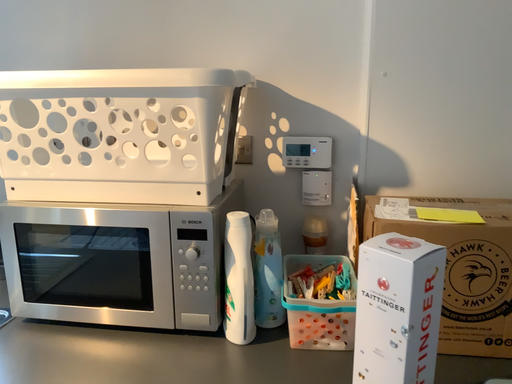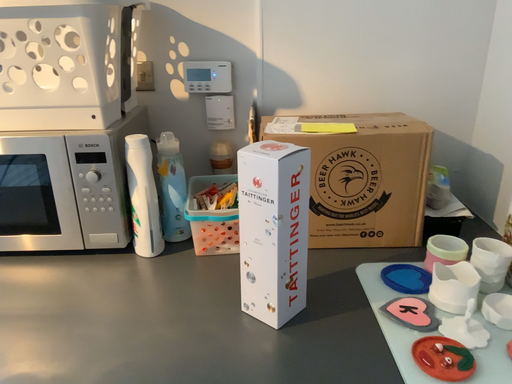
Question: How did the camera likely rotate when shooting the video?

Choices:
 (A) rotated left
 (B) rotated right

Answer: (B)